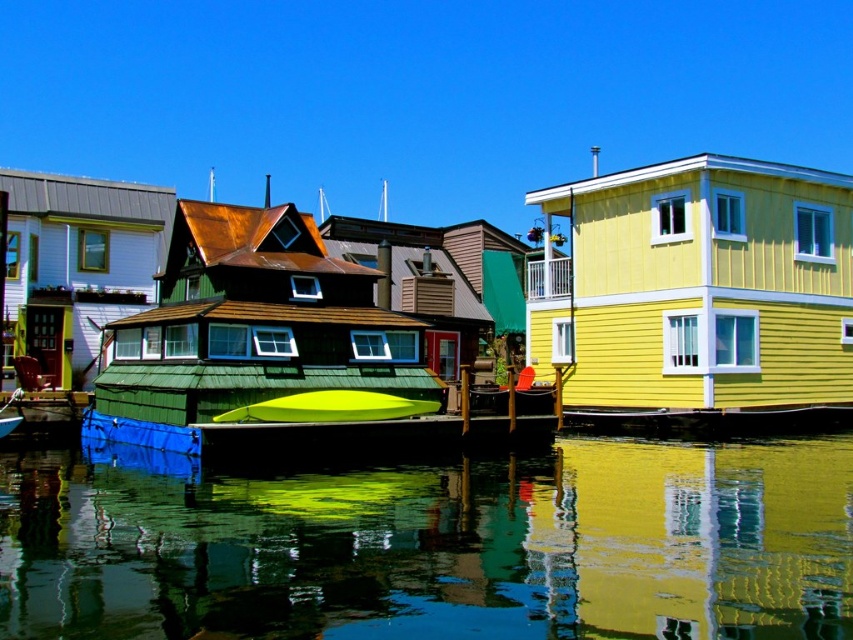
Does green reflective water at center have a lesser width compared to green matte kayak at center?

In fact, green reflective water at center might be wider than green matte kayak at center.

Can you confirm if green reflective water at center is wider than green matte kayak at center?

Yes, green reflective water at center is wider than green matte kayak at center.

This screenshot has width=853, height=640. In order to click on green reflective water at center in this screenshot , I will do `click(437, 547)`.